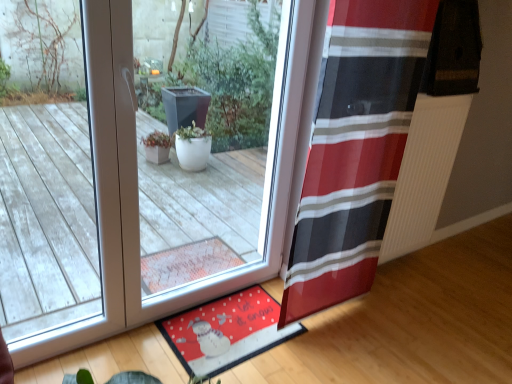
Describe the element at coordinates (355, 149) in the screenshot. I see `red striped curtain at right` at that location.

At what (x,y) coordinates should I click in order to perform the action: click on transparent glass window at center. Please return your answer as a coordinate pair (x, y). This screenshot has width=512, height=384. Looking at the image, I should click on (208, 137).

This screenshot has height=384, width=512. Describe the element at coordinates (226, 331) in the screenshot. I see `red fabric mat at lower center` at that location.

At what (x,y) coordinates should I click in order to perform the action: click on red striped curtain at right. Please return your answer as a coordinate pair (x, y). Looking at the image, I should click on (355, 149).

Which is behind, point (186, 355) or point (342, 295)?

Positioned behind is point (342, 295).

Is red fabric mat at lower center positioned far away from red striped curtain at right?

No.

How many degrees apart are the facing directions of red fabric mat at lower center and red striped curtain at right?

There is a 0.756-degree angle between the facing directions of red fabric mat at lower center and red striped curtain at right.

Can you confirm if red fabric mat at lower center is shorter than red striped curtain at right?

Indeed, red fabric mat at lower center has a lesser height compared to red striped curtain at right.

Could you tell me if red striped curtain at right is facing red fabric mat at lower center?

No.

Locate an element on the screen. mat lying on the left of red striped curtain at right is located at coordinates [226, 331].

Does red striped curtain at right touch red fabric mat at lower center?

red striped curtain at right and red fabric mat at lower center are clearly separated.

From the image's perspective, relative to transparent glass window at center, is red fabric mat at lower center above or below?

Based on their image positions, red fabric mat at lower center is located beneath transparent glass window at center.

Is red fabric mat at lower center at the left side of transparent glass window at center?

No, red fabric mat at lower center is not to the left of transparent glass window at center.

Identify the location of window in front of the red fabric mat at lower center. (208, 137).

From a real-world perspective, is red fabric mat at lower center over transparent glass window at center?

No, from a real-world perspective, red fabric mat at lower center is not above transparent glass window at center.

Can you confirm if transparent glass window at center is thinner than red fabric mat at lower center?

Correct, the width of transparent glass window at center is less than that of red fabric mat at lower center.

Which is behind, transparent glass window at center or red fabric mat at lower center?

red fabric mat at lower center.

Are transparent glass window at center and red fabric mat at lower center located far from each other?

No, transparent glass window at center is not far away from red fabric mat at lower center.

Does transparent glass window at center turn towards red fabric mat at lower center?

Yes.

Where is `curtain below the transparent glass window at center (from the image's perspective)`? This screenshot has height=384, width=512. curtain below the transparent glass window at center (from the image's perspective) is located at coordinates (355, 149).

Does transparent glass window at center have a greater width compared to red striped curtain at right?

Yes, transparent glass window at center is wider than red striped curtain at right.

Looking at this image, between transparent glass window at center and red striped curtain at right, which one has less height?

transparent glass window at center.

Is transparent glass window at center smaller than red striped curtain at right?

No, transparent glass window at center is not smaller than red striped curtain at right.

From the image's perspective, is red striped curtain at right beneath transparent glass window at center?

Yes, from the image's perspective, red striped curtain at right is beneath transparent glass window at center.

Is red striped curtain at right wider than transparent glass window at center?

No.

From their relative heights in the image, would you say red striped curtain at right is taller or shorter than transparent glass window at center?

red striped curtain at right is taller than transparent glass window at center.

This screenshot has width=512, height=384. In the image, there is a red striped curtain at right. Find the location of `window below it (from a real-world perspective)`. window below it (from a real-world perspective) is located at coordinates (208, 137).

I want to click on curtain above the red fabric mat at lower center (from the image's perspective), so click(355, 149).

This screenshot has width=512, height=384. In order to click on curtain above the red fabric mat at lower center (from a real-world perspective) in this screenshot , I will do `click(355, 149)`.

Based on their spatial positions, is red fabric mat at lower center or transparent glass window at center closer to red striped curtain at right?

The object closer to red striped curtain at right is red fabric mat at lower center.

From the image, which object appears to be farther from transparent glass window at center, red fabric mat at lower center or red striped curtain at right?

red striped curtain at right lies further to transparent glass window at center than the other object.

Which object lies nearer to the anchor point red fabric mat at lower center, transparent glass window at center or red striped curtain at right?

Based on the image, transparent glass window at center appears to be nearer to red fabric mat at lower center.

Estimate the real-world distances between objects in this image. Which object is closer to red striped curtain at right, transparent glass window at center or red fabric mat at lower center?

Among the two, red fabric mat at lower center is located nearer to red striped curtain at right.

When comparing their distances from transparent glass window at center, does red striped curtain at right or red fabric mat at lower center seem closer?

Among the two, red fabric mat at lower center is located nearer to transparent glass window at center.

Based on their spatial positions, is red striped curtain at right or transparent glass window at center closer to red fabric mat at lower center?

Among the two, transparent glass window at center is located nearer to red fabric mat at lower center.

The image size is (512, 384). Find the location of `curtain between transparent glass window at center and red fabric mat at lower center from top to bottom`. curtain between transparent glass window at center and red fabric mat at lower center from top to bottom is located at coordinates (355, 149).